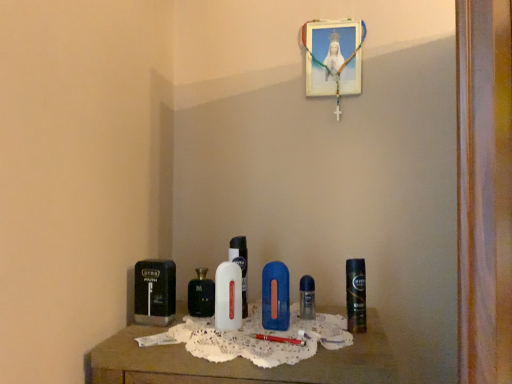
Where is `vacant space that is in between blue plastic razor at center, arranged as the second personal care when viewed from the right, and black plastic razor at left, which is the 3th personal care from right to left`? The height and width of the screenshot is (384, 512). vacant space that is in between blue plastic razor at center, arranged as the second personal care when viewed from the right, and black plastic razor at left, which is the 3th personal care from right to left is located at coordinates (205, 326).